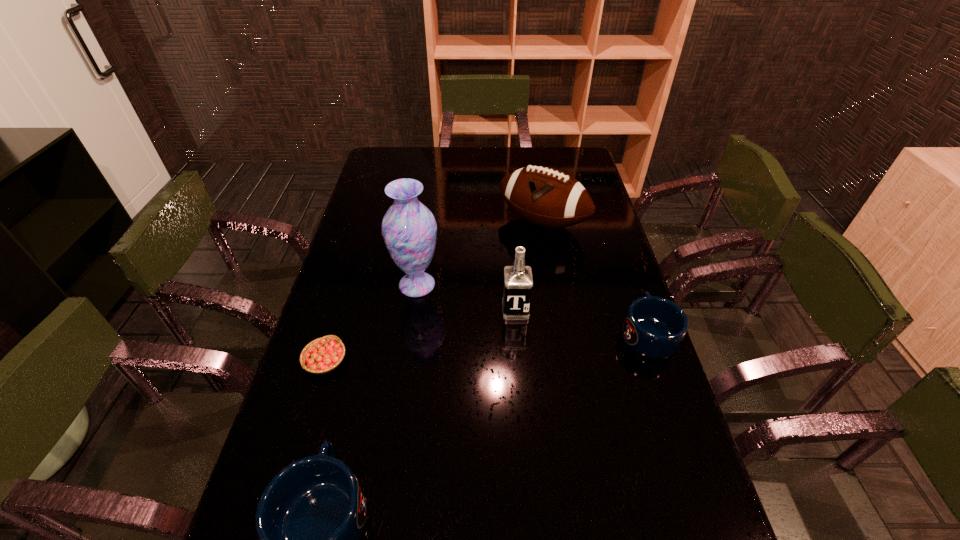
Locate an element on the screen. The width and height of the screenshot is (960, 540). object that can be found as the closest to the vodka is located at coordinates (409, 229).